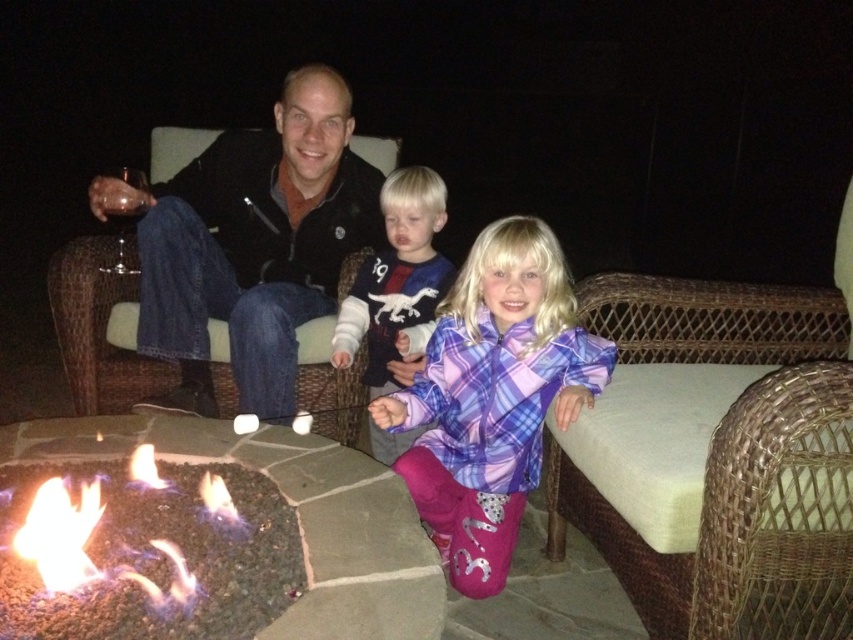
You are trying to decide which item to grab first if you need to take something from the scene. The plush fleece sweater at center and the flamegasfire at lower left are both in your line of sight. Which one is narrower in width?

The plush fleece sweater at center is thinner than flamegasfire at lower left, so the plush fleece sweater at center is narrower in width.

You are trying to decide which item to place in a storage box that can only hold items up to the width of the plush fleece sweater at center. Can you put the dark blue jeans at center into the box?

The dark blue jeans at center is wider than the plush fleece sweater at center, so it cannot fit into the storage box designed for items up to the width of the plush fleece sweater at center.

You are a photographer trying to capture a candid shot of the dark blue jeans at center and the purple plaid jacket at center. Since you want to ensure both are in frame, which object should you position closer to the left side of your camera viewfinder?

The dark blue jeans at center should be positioned closer to the left side of the camera viewfinder because it is already on the left side of the purple plaid jacket at center.